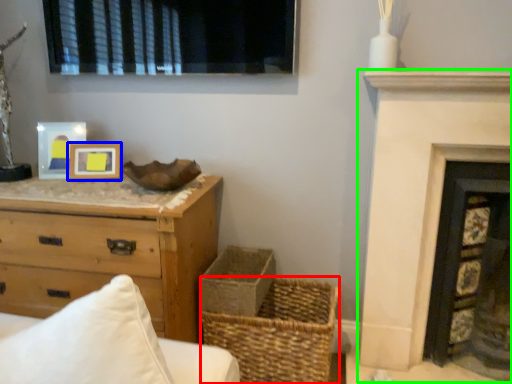
Question: Estimate the real-world distances between objects in this image. Which object is closer to basket (highlighted by a red box), picture frame (highlighted by a blue box) or fireplace (highlighted by a green box)?

Choices:
 (A) picture frame
 (B) fireplace

Answer: (B)